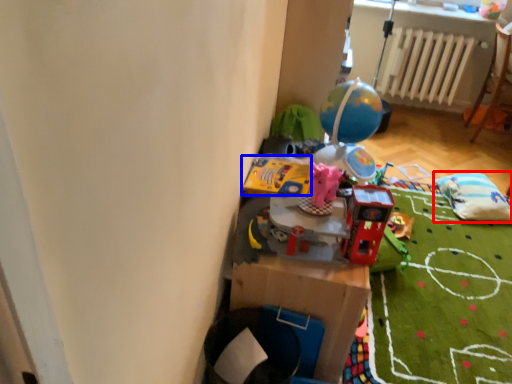
Question: Which object is closer to the camera taking this photo, bean bag chair (highlighted by a red box) or toy (highlighted by a blue box)?

Choices:
 (A) bean bag chair
 (B) toy

Answer: (B)